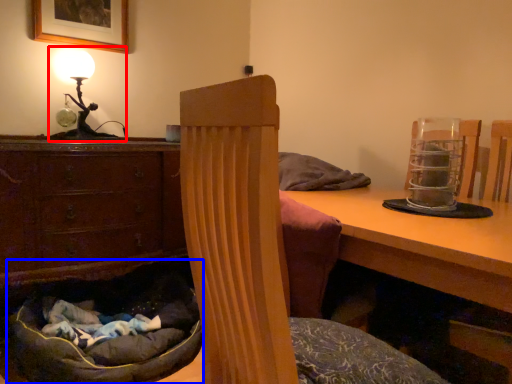
Question: Which point is closer to the camera, table lamp (highlighted by a red box) or bean bag chair (highlighted by a blue box)?

Choices:
 (A) table lamp
 (B) bean bag chair

Answer: (B)